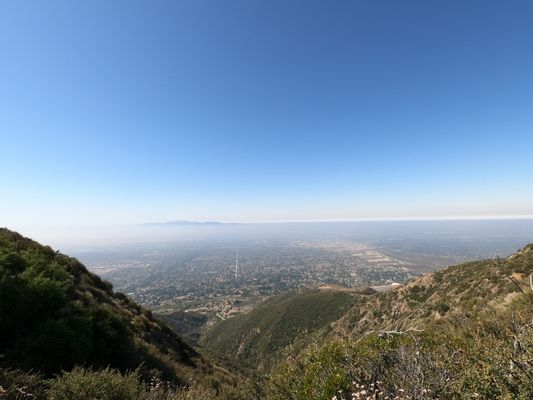
The width and height of the screenshot is (533, 400). What are the coordinates of `corner` in the screenshot? It's located at (516, 386), (19, 385), (12, 29), (519, 11).